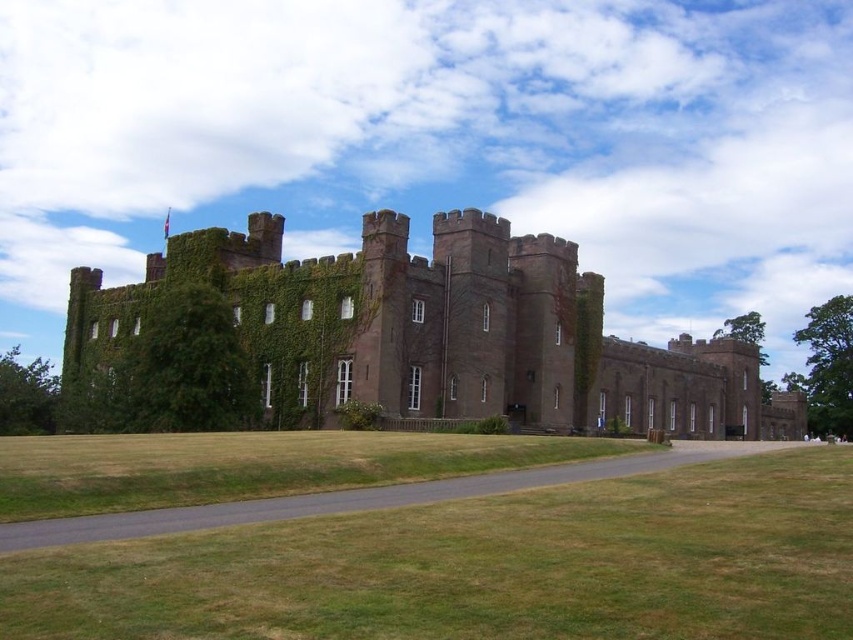
Question: Among these objects, which one is farthest from the camera?

Choices:
 (A) green ivy at left
 (B) brown stone castle at center

Answer: (A)

Question: Can you confirm if brown stone castle at center is positioned above green ivy at left?

Choices:
 (A) yes
 (B) no

Answer: (B)

Question: Is brown stone castle at center positioned behind green ivy at left?

Choices:
 (A) no
 (B) yes

Answer: (A)

Question: Among these points, which one is farthest from the camera?

Choices:
 (A) (473, 294)
 (B) (212, 333)

Answer: (A)

Question: Considering the relative positions of brown stone castle at center and green ivy at left in the image provided, where is brown stone castle at center located with respect to green ivy at left?

Choices:
 (A) right
 (B) left

Answer: (A)